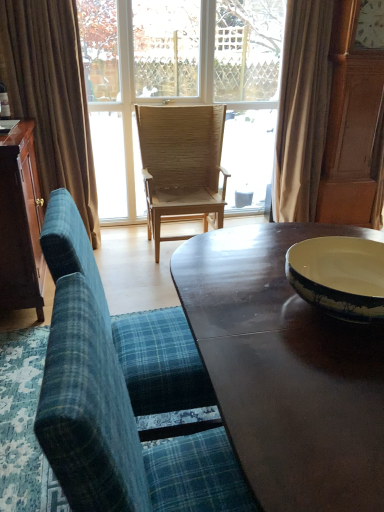
Identify the location of free location in front of yellow ceramic bowl at right. (321, 388).